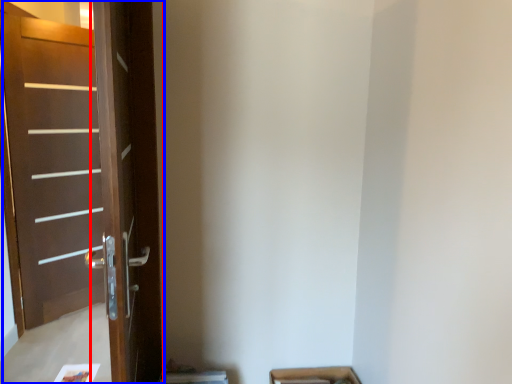
Question: Which object appears farthest to the camera in this image, screen door (highlighted by a red box) or door (highlighted by a blue box)?

Choices:
 (A) screen door
 (B) door

Answer: (B)